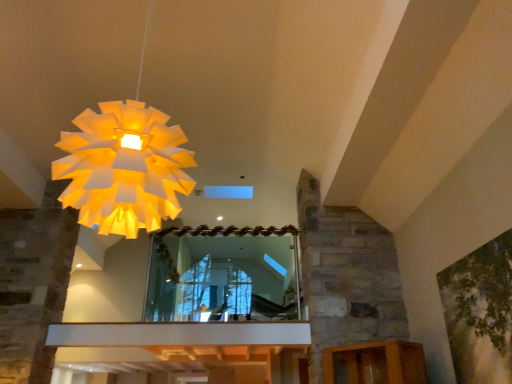
Question: Can you confirm if white paper lampshade at upper left is smaller than clear glass mirror at center?

Choices:
 (A) yes
 (B) no

Answer: (B)

Question: Does white paper lampshade at upper left have a lesser width compared to clear glass mirror at center?

Choices:
 (A) no
 (B) yes

Answer: (A)

Question: Does white paper lampshade at upper left come in front of clear glass mirror at center?

Choices:
 (A) no
 (B) yes

Answer: (B)

Question: Is white paper lampshade at upper left further to camera compared to clear glass mirror at center?

Choices:
 (A) yes
 (B) no

Answer: (B)

Question: Considering the relative sizes of white paper lampshade at upper left and clear glass mirror at center in the image provided, is white paper lampshade at upper left shorter than clear glass mirror at center?

Choices:
 (A) yes
 (B) no

Answer: (B)

Question: Which is correct: white paper lampshade at upper left is inside clear glass mirror at center, or outside of it?

Choices:
 (A) outside
 (B) inside

Answer: (A)

Question: Is white paper lampshade at upper left bigger or smaller than clear glass mirror at center?

Choices:
 (A) small
 (B) big

Answer: (B)

Question: From the image's perspective, is white paper lampshade at upper left above or below clear glass mirror at center?

Choices:
 (A) above
 (B) below

Answer: (A)

Question: Considering the positions of white paper lampshade at upper left and clear glass mirror at center in the image, is white paper lampshade at upper left wider or thinner than clear glass mirror at center?

Choices:
 (A) wide
 (B) thin

Answer: (A)

Question: From a real-world perspective, relative to green leafy tree at upper right, is clear glass mirror at center vertically above or below?

Choices:
 (A) above
 (B) below

Answer: (A)

Question: From the image's perspective, is clear glass mirror at center located above or below green leafy tree at upper right?

Choices:
 (A) above
 (B) below

Answer: (B)

Question: Is point (270, 307) positioned closer to the camera than point (458, 299)?

Choices:
 (A) closer
 (B) farther

Answer: (B)

Question: Looking at the image, does clear glass mirror at center seem bigger or smaller compared to green leafy tree at upper right?

Choices:
 (A) big
 (B) small

Answer: (A)

Question: Would you say green leafy tree at upper right is inside or outside clear glass mirror at center?

Choices:
 (A) outside
 (B) inside

Answer: (A)

Question: Is green leafy tree at upper right wider or thinner than clear glass mirror at center?

Choices:
 (A) thin
 (B) wide

Answer: (A)